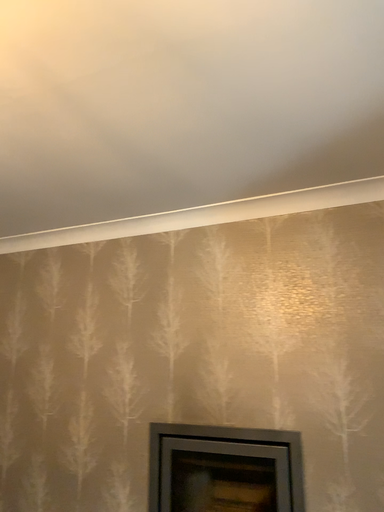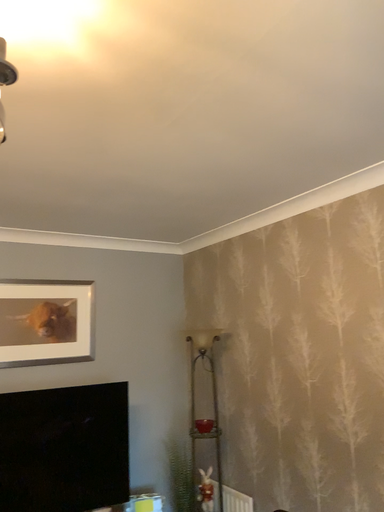
Question: How did the camera likely rotate when shooting the video?

Choices:
 (A) rotated upward
 (B) rotated downward

Answer: (B)